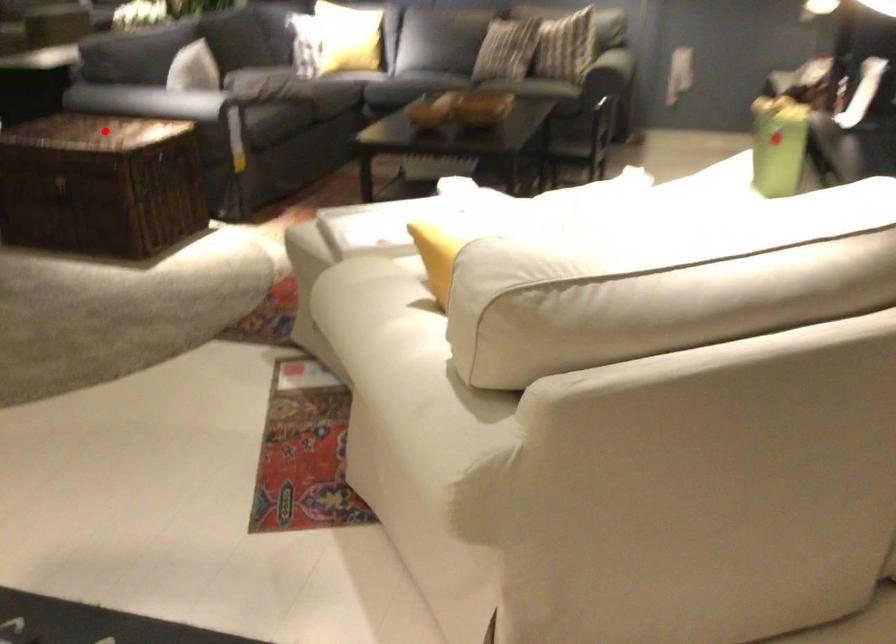
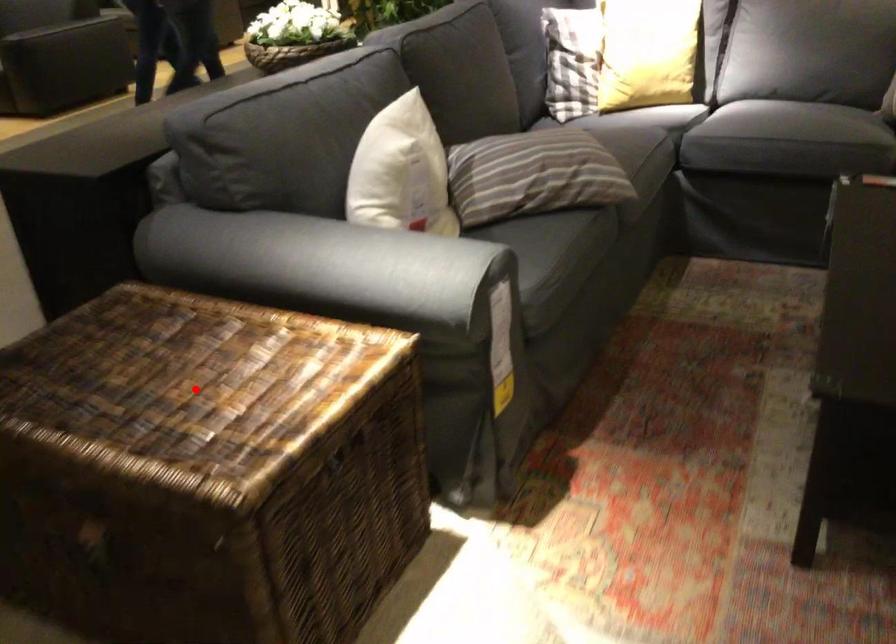
I am providing you with two images of the same scene from different viewpoints. A red point is marked on the first image and another point is marked on the second image. Do the highlighted points in image1 and image2 indicate the same real-world spot?

Yes